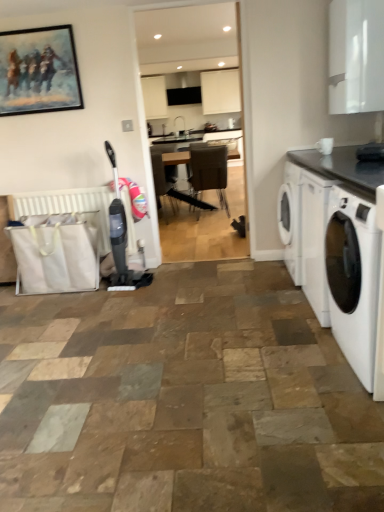
Question: From a real-world perspective, is brown leather chair at center positioned over white fabric radiator at lower left based on gravity?

Choices:
 (A) no
 (B) yes

Answer: (B)

Question: Is brown leather chair at center positioned beyond the bounds of white fabric radiator at lower left?

Choices:
 (A) no
 (B) yes

Answer: (B)

Question: Is brown leather chair at center further to the viewer compared to white fabric radiator at lower left?

Choices:
 (A) no
 (B) yes

Answer: (B)

Question: Does brown leather chair at center have a lesser width compared to white fabric radiator at lower left?

Choices:
 (A) yes
 (B) no

Answer: (B)

Question: Does brown leather chair at center have a greater width compared to white fabric radiator at lower left?

Choices:
 (A) no
 (B) yes

Answer: (B)

Question: Considering the relative sizes of brown leather chair at center and white fabric radiator at lower left in the image provided, is brown leather chair at center taller than white fabric radiator at lower left?

Choices:
 (A) no
 (B) yes

Answer: (B)

Question: From the image's perspective, is oil painting at upper left located above white glossy washing machine at right?

Choices:
 (A) yes
 (B) no

Answer: (A)

Question: Can we say oil painting at upper left lies outside white glossy washing machine at right?

Choices:
 (A) yes
 (B) no

Answer: (A)

Question: Is oil painting at upper left far from white glossy washing machine at right?

Choices:
 (A) yes
 (B) no

Answer: (A)

Question: Considering the relative sizes of oil painting at upper left and white glossy washing machine at right in the image provided, is oil painting at upper left shorter than white glossy washing machine at right?

Choices:
 (A) yes
 (B) no

Answer: (A)

Question: Does oil painting at upper left appear on the left side of white glossy washing machine at right?

Choices:
 (A) yes
 (B) no

Answer: (A)

Question: Is white glossy washing machine at right surrounded by oil painting at upper left?

Choices:
 (A) no
 (B) yes

Answer: (A)

Question: Is white fabric radiator at lower left turned away from black granite countertop at right?

Choices:
 (A) no
 (B) yes

Answer: (A)